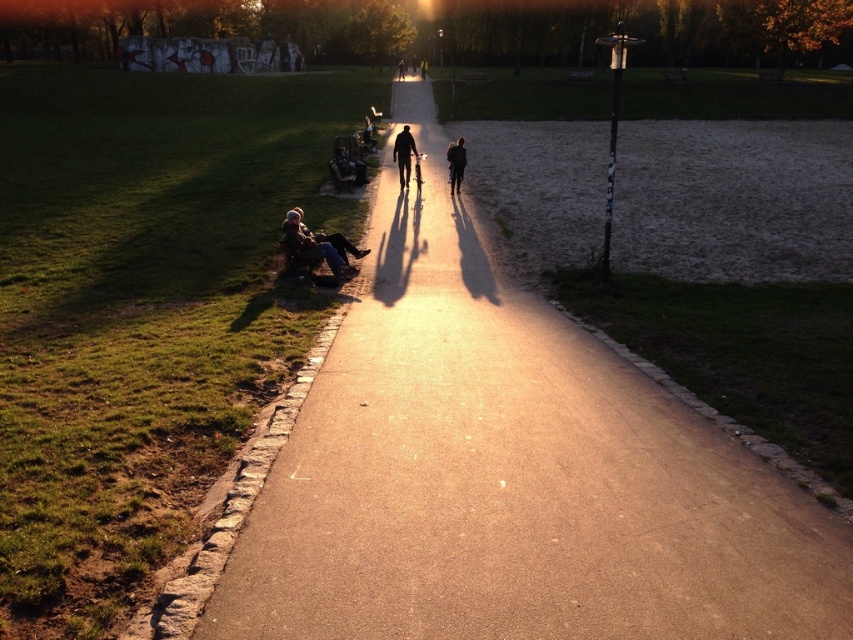
Does dark brown leather jacket at lower left have a smaller size compared to dark brown leather jacket at center?

Yes.

Is point (299, 212) more distant than point (448, 161)?

No, it is not.

Locate an element on the screen. This screenshot has height=640, width=853. dark brown leather jacket at lower left is located at coordinates (309, 244).

Consider the image. Is smooth asphalt path at center in front of dark brown leather jacket at lower left?

Yes.

Which is below, smooth asphalt path at center or dark brown leather jacket at lower left?

Positioned lower is smooth asphalt path at center.

Measure the distance between point [350,490] and camera.

Point [350,490] is 5.70 meters from camera.

Where is `smooth asphalt path at center`? This screenshot has height=640, width=853. smooth asphalt path at center is located at coordinates (509, 474).

Does point (398, 328) come behind point (403, 140)?

No, (398, 328) is closer to viewer.

Is point (413, 598) in front of point (416, 156)?

Yes, it is in front of point (416, 156).

Locate an element on the screen. Image resolution: width=853 pixels, height=640 pixels. smooth asphalt path at center is located at coordinates pyautogui.click(x=509, y=474).